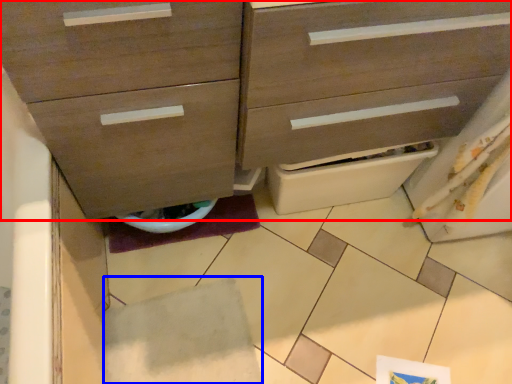
Question: Which point is closer to the camera, chest of drawers (highlighted by a red box) or tile (highlighted by a blue box)?

Choices:
 (A) chest of drawers
 (B) tile

Answer: (A)